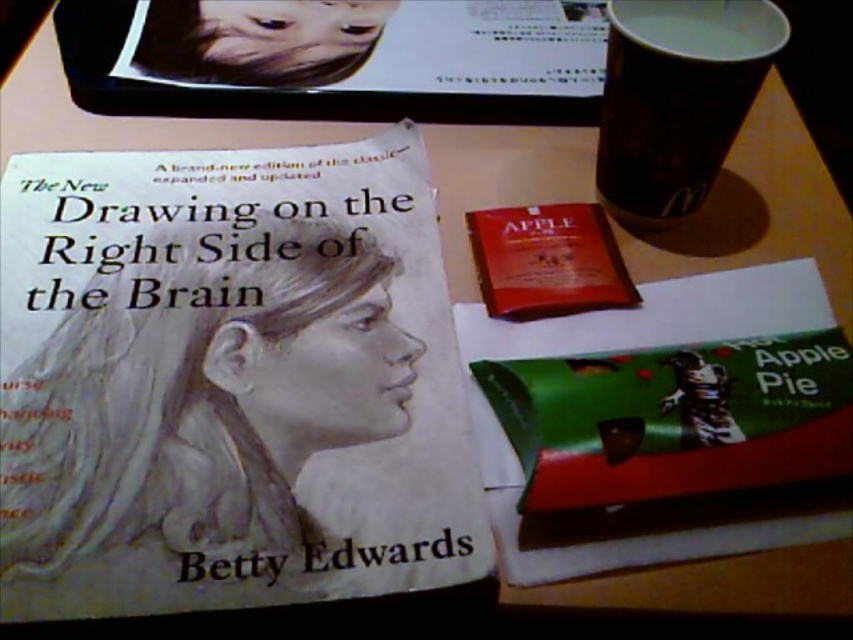
You are organizing items on a table and need to place the green matte hot apple pie at center and the matte red packet at center. According to the scene, which item is located to the left of the other?

The matte red packet at center is located to the left of the green matte hot apple pie at center because the green matte hot apple pie at center is positioned on the right side of the matte red packet at center.

You are organizing items on a table and need to place both the matte white book at center and the white paper cup at upper right. Which item should you place first if you want to ensure there is enough space for both?

You should place the matte white book at center first since it is larger than the white paper cup at upper right, ensuring there is enough space for both items.

Looking at this image, you are a delivery robot with a height of 12 inches. You need to pick up the green matte hot apple pie at center from the table. Can you reach it without tipping over?

The green matte hot apple pie at center is 11.97 inches away from the viewer. Since the robot is 12 inches tall, it can just barely reach the pie without tipping over.